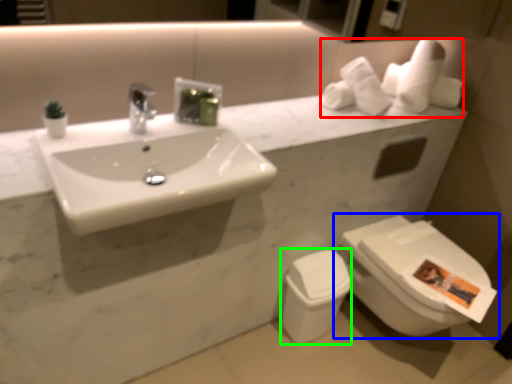
Question: Considering the real-world distances, which object is farthest from toilet paper (highlighted by a red box)? toilet (highlighted by a blue box) or toilet bowl (highlighted by a green box)?

Choices:
 (A) toilet
 (B) toilet bowl

Answer: (B)